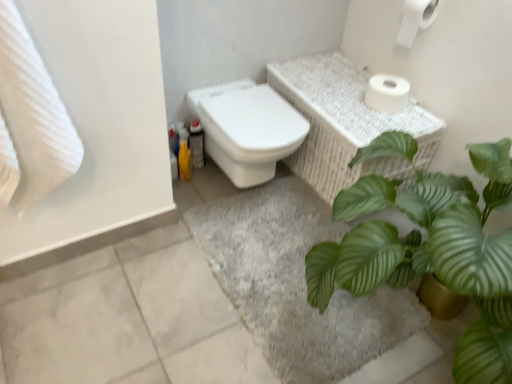
Where is `free spot above gray soft rug at lower center (from a real-world perspective)`? This screenshot has height=384, width=512. free spot above gray soft rug at lower center (from a real-world perspective) is located at coordinates (292, 267).